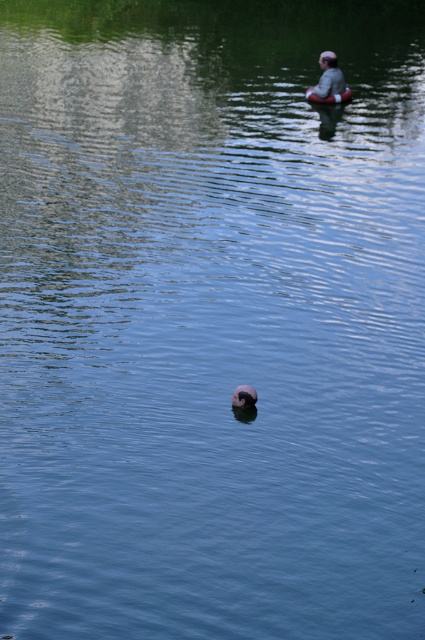
Question: Does smooth plastic canoe at upper center have a lesser width compared to smooth pink rubber ring at upper center?

Choices:
 (A) yes
 (B) no

Answer: (B)

Question: Can you confirm if light gray fabric person at upper center is thinner than smooth pink rubber ring at upper center?

Choices:
 (A) no
 (B) yes

Answer: (A)

Question: Based on their relative distances, which object is nearer to the smooth plastic canoe at upper center?

Choices:
 (A) light gray fabric person at upper center
 (B) smooth pink rubber ring at upper center

Answer: (A)

Question: Does smooth plastic canoe at upper center appear under smooth pink rubber ring at upper center?

Choices:
 (A) yes
 (B) no

Answer: (B)

Question: Which object is the farthest from the light gray fabric person at upper center?

Choices:
 (A) smooth pink rubber ring at upper center
 (B) smooth plastic canoe at upper center

Answer: (A)

Question: Which point appears closest to the camera in this image?

Choices:
 (A) (340, 93)
 (B) (232, 397)

Answer: (B)